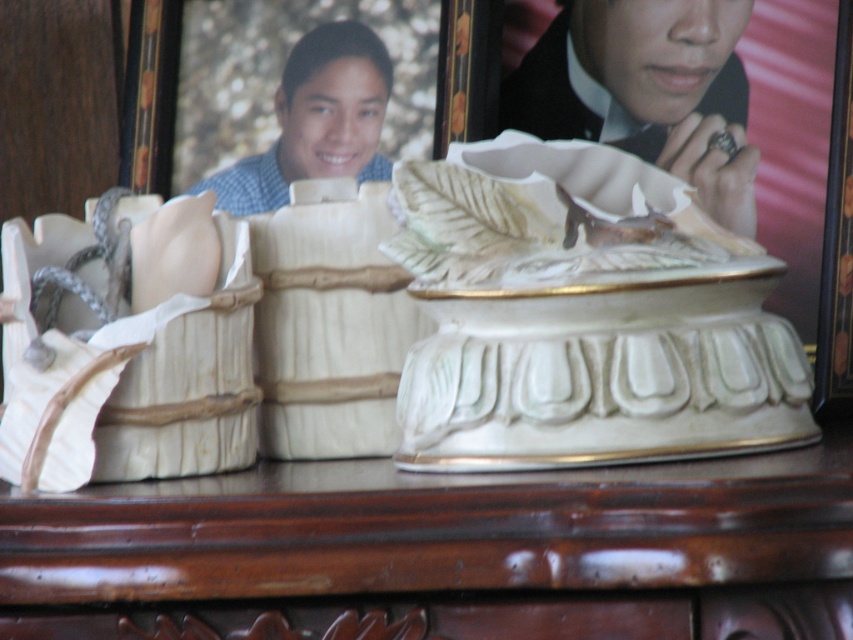
Question: Is the position of mahogany wood table at center less distant than that of porcelain leaf at center?

Choices:
 (A) yes
 (B) no

Answer: (A)

Question: Can you confirm if mahogany wood table at center is thinner than porcelain leaf at center?

Choices:
 (A) yes
 (B) no

Answer: (B)

Question: Among these objects, which one is nearest to the camera?

Choices:
 (A) porcelain leaf at center
 (B) mahogany wood table at center
 (C) blue checkered shirt at upper center
 (D) matte black ring at upper right

Answer: (B)

Question: Estimate the real-world distances between objects in this image. Which object is closer to the porcelain leaf at center?

Choices:
 (A) blue checkered shirt at upper center
 (B) matte black ring at upper right

Answer: (B)

Question: Is porcelain leaf at center below blue checkered shirt at upper center?

Choices:
 (A) yes
 (B) no

Answer: (A)

Question: Which point is farther to the camera?

Choices:
 (A) (672, 77)
 (B) (39, 557)
 (C) (585, 196)
 (D) (207, 188)

Answer: (D)